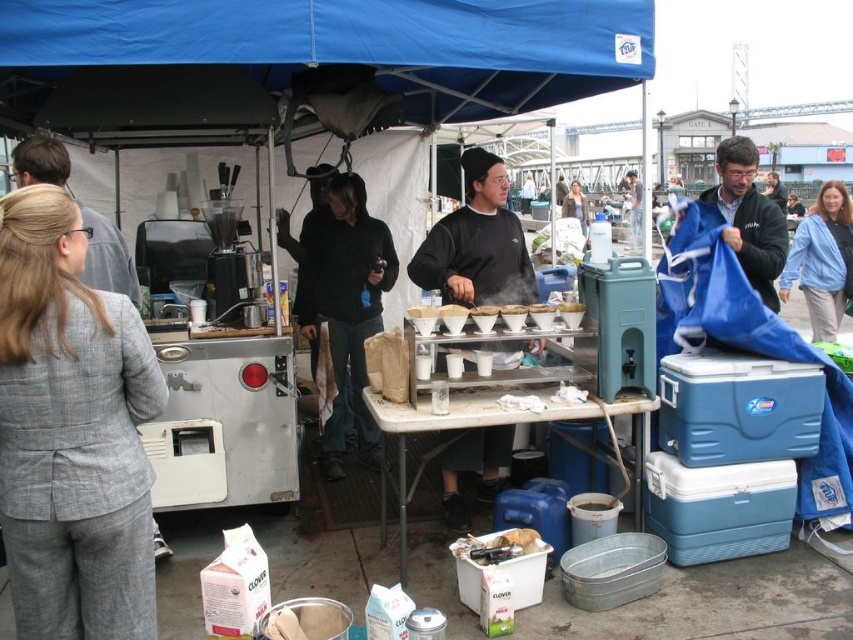
Who is more forward, (22, 65) or (563, 308)?

Point (22, 65)

Which of these two, blue fabric canopy at upper center or white paper cup at center, stands shorter?

Standing shorter between the two is white paper cup at center.

Is point (395, 88) positioned in front of point (566, 305)?

No, (395, 88) is further to viewer.

Find the location of a particular element. The image size is (853, 640). blue fabric canopy at upper center is located at coordinates (357, 44).

Is black cotton hoodie at center positioned at the back of dark blue fabric at right?

Yes, it is.

Can you confirm if black cotton hoodie at center is positioned below dark blue fabric at right?

Indeed, black cotton hoodie at center is positioned under dark blue fabric at right.

Which is behind, point (368, 253) or point (766, 230)?

Point (368, 253)

Where is `black cotton hoodie at center`? black cotton hoodie at center is located at coordinates (345, 307).

Does point (1, 403) come in front of point (804, 272)?

Yes, point (1, 403) is in front of point (804, 272).

Does point (12, 563) come farther from viewer compared to point (807, 266)?

No, (12, 563) is in front of (807, 266).

Image resolution: width=853 pixels, height=640 pixels. I want to click on gray wool suit at left, so click(71, 433).